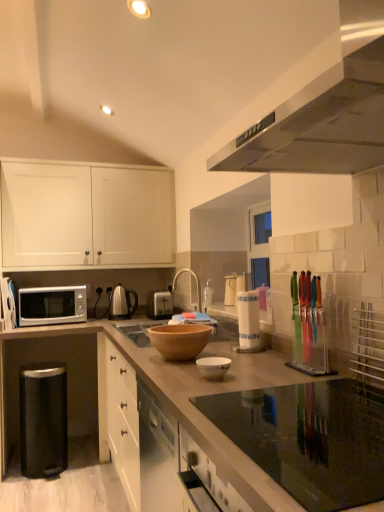
Identify the location of vacant area located to the right-hand side of black matte trash can at lower left. The image size is (384, 512). (90, 471).